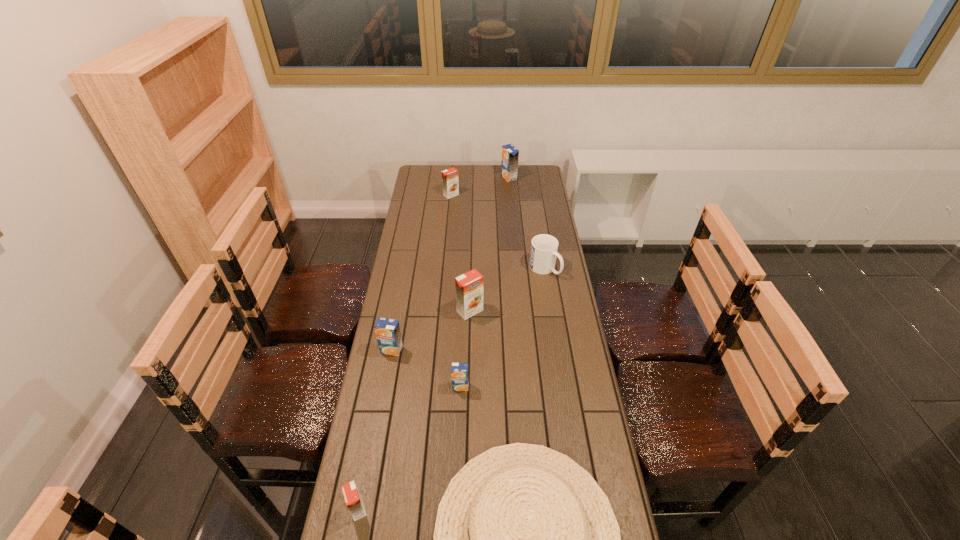
Find the location of a particular element. vacant area located 0.330m on the right of the smallest orange orange juice is located at coordinates (489, 509).

The image size is (960, 540). Identify the location of object positioned at the far edge. (510, 154).

I want to click on orange_juice that is at the right edge, so click(x=510, y=154).

Where is `mug located at the right edge`? Image resolution: width=960 pixels, height=540 pixels. mug located at the right edge is located at coordinates (544, 247).

The width and height of the screenshot is (960, 540). I want to click on object at the far right corner, so click(510, 154).

Image resolution: width=960 pixels, height=540 pixels. What are the coordinates of `free space at the far edge` in the screenshot? It's located at (475, 177).

This screenshot has width=960, height=540. I want to click on free space at the left edge of the desktop, so click(x=436, y=208).

The height and width of the screenshot is (540, 960). In the image, there is a desktop. In order to click on free region at the right edge in this screenshot , I will do `click(529, 222)`.

In the image, there is a desktop. Where is `vacant area at the far right corner`? This screenshot has height=540, width=960. vacant area at the far right corner is located at coordinates (527, 169).

You are a GUI agent. You are given a task and a screenshot of the screen. Output one action in this format:
    pyautogui.click(x=<x>, y=<y>)
    Task: Click on the free space between the nearest blue orange_juice and the biggest blue orange_juice
    The width and height of the screenshot is (960, 540).
    Given the screenshot: What is the action you would take?
    pyautogui.click(x=485, y=282)